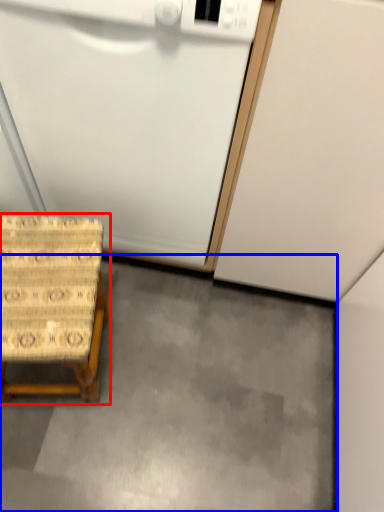
Question: Which object is further to the camera taking this photo, furniture (highlighted by a red box) or concrete (highlighted by a blue box)?

Choices:
 (A) furniture
 (B) concrete

Answer: (B)